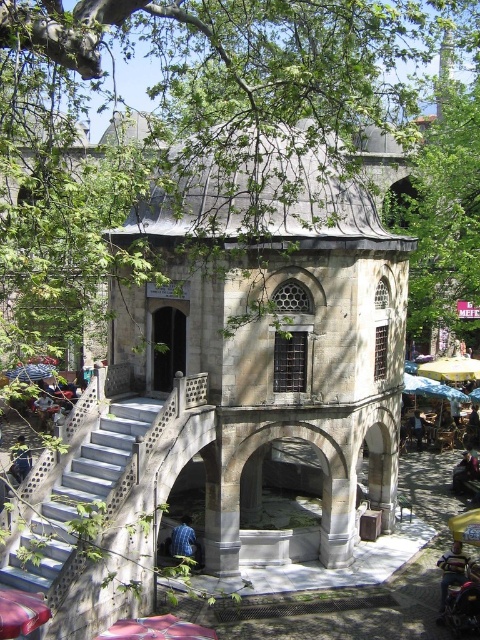
Can you confirm if stone gazebo at center is smaller than metallic red car at lower left?

No, stone gazebo at center is not smaller than metallic red car at lower left.

Looking at this image, does stone gazebo at center appear under metallic red car at lower left?

Incorrect, stone gazebo at center is not positioned below metallic red car at lower left.

Which is behind, point (316, 204) or point (31, 621)?

Point (316, 204)

The width and height of the screenshot is (480, 640). Identify the location of stone gazebo at center. (277, 340).

Can you confirm if green leafy tree at upper left is wider than white concrete stairs at lower left?

Yes.

Is green leafy tree at upper left positioned before white concrete stairs at lower left?

That is True.

This screenshot has width=480, height=640. Find the location of `green leafy tree at upper left`. green leafy tree at upper left is located at coordinates (230, 145).

From the picture: Is stone gazebo at center below white concrete stairs at lower left?

No, stone gazebo at center is not below white concrete stairs at lower left.

Which is more to the right, stone gazebo at center or white concrete stairs at lower left?

stone gazebo at center is more to the right.

Between point (123, 224) and point (28, 541), which one is positioned behind?

Point (123, 224)

Identify the location of stone gazebo at center. (277, 340).